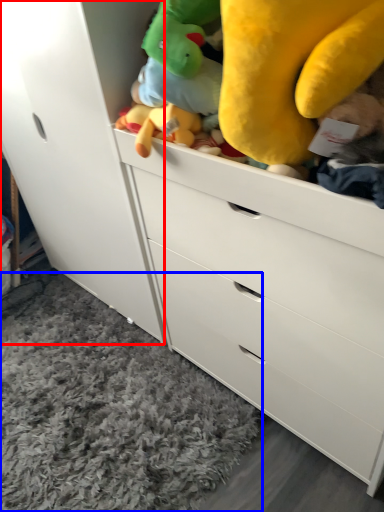
Question: Among these objects, which one is nearest to the camera, cabinetry (highlighted by a red box) or plain (highlighted by a blue box)?

Choices:
 (A) cabinetry
 (B) plain

Answer: (A)